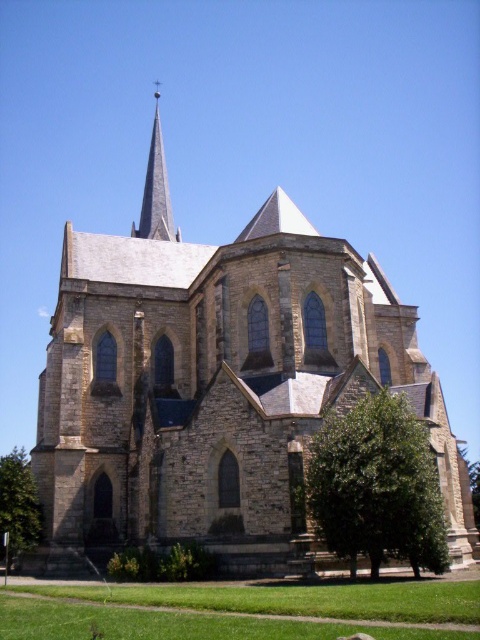
Is brown stone church at center thinner than green leafy tree at lower left?

Indeed, brown stone church at center has a lesser width compared to green leafy tree at lower left.

Does brown stone church at center appear on the left side of green leafy tree at lower left?

In fact, brown stone church at center is to the right of green leafy tree at lower left.

What do you see at coordinates (216, 388) in the screenshot? The width and height of the screenshot is (480, 640). I see `brown stone church at center` at bounding box center [216, 388].

Find the location of a particular element. brown stone church at center is located at coordinates (216, 388).

Can you confirm if green leafy tree at lower right is positioned above smooth gray steeple at upper center?

No.

Which is behind, point (381, 516) or point (156, 184)?

The point (156, 184) is behind.

Identify the location of green leafy tree at lower right. (376, 484).

In the scene shown: Between brown stone church at center and green leafy tree at lower right, which one has less height?

Standing shorter between the two is green leafy tree at lower right.

Is point (215, 484) less distant than point (416, 433)?

No.

Find the location of a particular element. This screenshot has height=640, width=480. brown stone church at center is located at coordinates (216, 388).